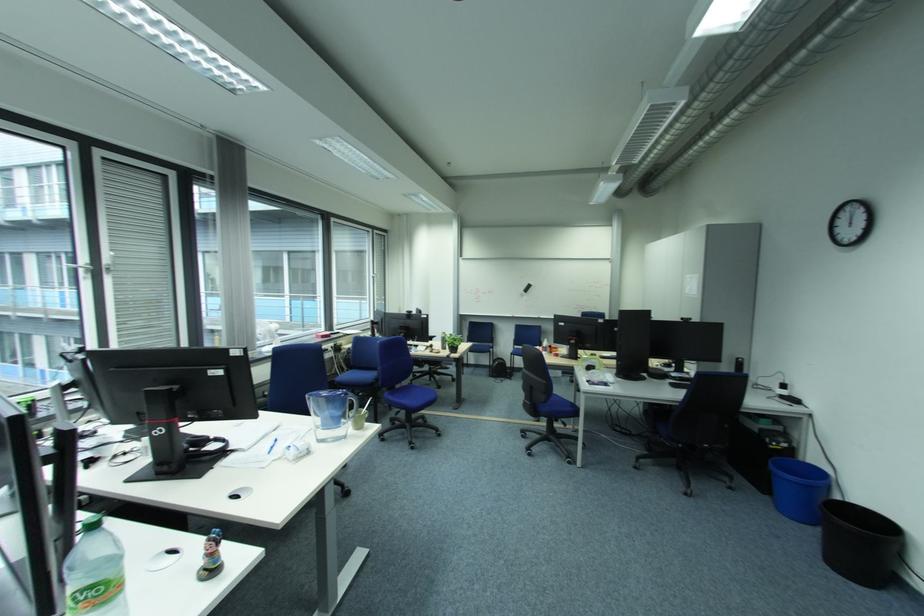
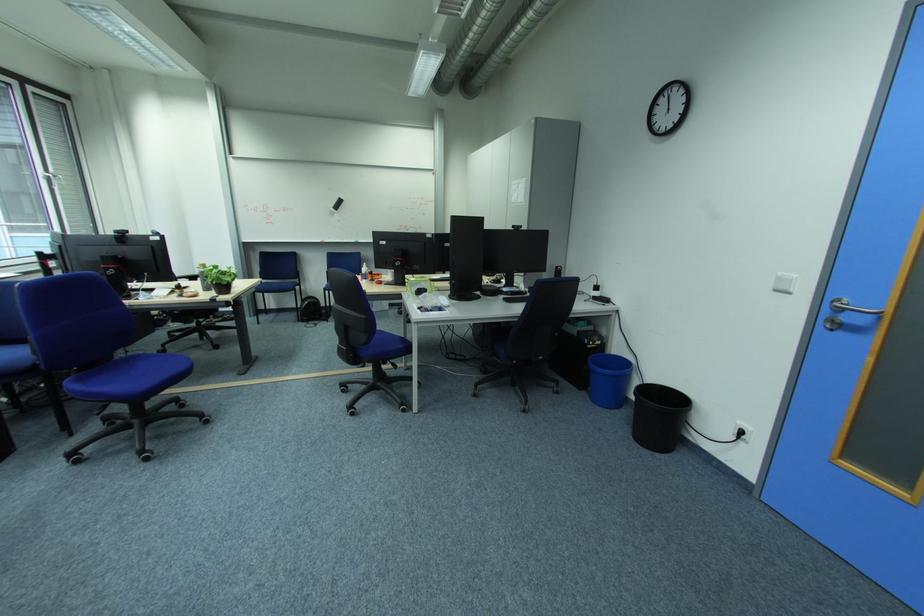
Where in the second image is the point corresponding to [553,403] from the first image?

(375, 344)